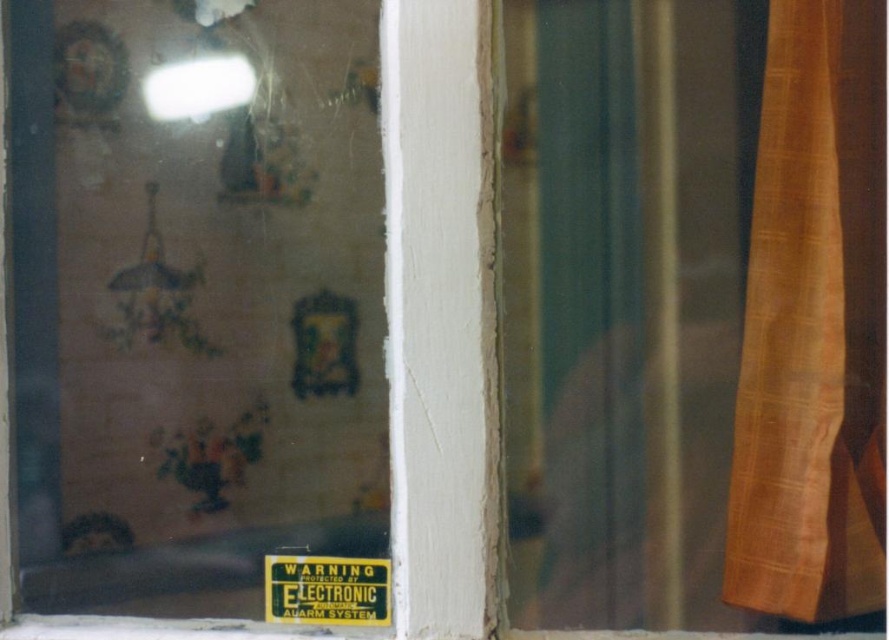
From the picture: Which of these two, transparent glass window at upper left or orange woven fabric curtain at right, stands shorter?

orange woven fabric curtain at right is shorter.

Looking at this image, between transparent glass window at upper left and orange woven fabric curtain at right, which one appears on the left side from the viewer's perspective?

transparent glass window at upper left

Is point (108, 346) more distant than point (802, 492)?

Yes, point (108, 346) is farther from viewer.

This screenshot has width=889, height=640. Find the location of `transparent glass window at upper left`. transparent glass window at upper left is located at coordinates (191, 301).

Between point (837, 332) and point (367, 586), which one is positioned behind?

The point (367, 586) is behind.

This screenshot has width=889, height=640. Identify the location of orange woven fabric curtain at right. (814, 324).

Between transparent glass window at upper left and yellow/black electronic sign at center, which one appears on the right side from the viewer's perspective?

Positioned to the right is yellow/black electronic sign at center.

Who is more forward, (91,4) or (334,560)?

Point (334,560)

Is point (135, 36) less distant than point (319, 561)?

No, (135, 36) is further to viewer.

Where is `transparent glass window at upper left`? transparent glass window at upper left is located at coordinates (191, 301).